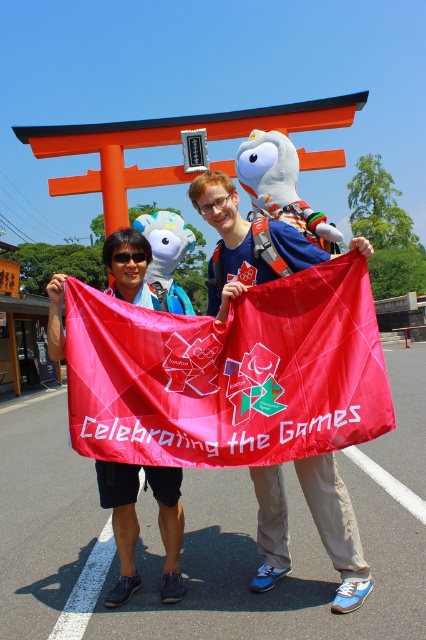
Question: Can you confirm if matte fabric flag at center is positioned to the left of matte pink flag at center?

Choices:
 (A) no
 (B) yes

Answer: (A)

Question: Does matte fabric flag at center appear on the right side of matte blue shirt at center?

Choices:
 (A) yes
 (B) no

Answer: (B)

Question: Among these points, which one is nearest to the camera?

Choices:
 (A) (123, 564)
 (B) (310, 483)

Answer: (B)

Question: Which object appears farthest from the camera in this image?

Choices:
 (A) matte blue shirt at center
 (B) matte pink flag at center
 (C) white plush toy at center

Answer: (C)

Question: In this image, where is matte fabric flag at center located relative to matte blue shirt at center?

Choices:
 (A) below
 (B) above

Answer: (B)

Question: Among these points, which one is farthest from the camera?

Choices:
 (A) (287, 438)
 (B) (104, 240)

Answer: (B)